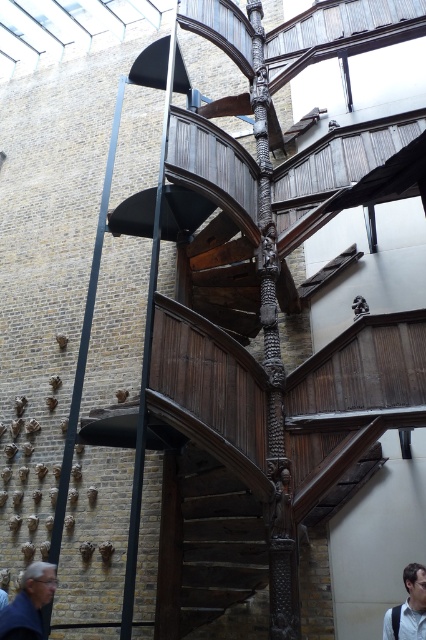
You are a GUI agent. You are given a task and a screenshot of the screen. Output one action in this format:
    pyautogui.click(x=<x>, y=<y>)
    Task: Click on the gray hair at lower left
    The height and width of the screenshot is (640, 426).
    Given the screenshot: What is the action you would take?
    28,604

Who is positioned more to the left, gray hair at lower left or light blue shirt at lower right?

Positioned to the left is gray hair at lower left.

Is point (23, 598) behind point (417, 593)?

No, (23, 598) is closer to viewer.

The height and width of the screenshot is (640, 426). What are the coordinates of `gray hair at lower left` in the screenshot? It's located at (28, 604).

Is black metal pole at center bigger than light blue shirt at lower right?

Yes.

The image size is (426, 640). Find the location of `black metal pole at center`. black metal pole at center is located at coordinates (146, 364).

Is point (169, 77) closer to viewer compared to point (416, 621)?

No, (169, 77) is further to viewer.

This screenshot has height=640, width=426. Identify the location of black metal pole at center. (146, 364).

Is point (201, 541) closer to camera compared to point (68, 464)?

That is False.

Between wooden stairs at center and black metal pole at left, which one appears on the right side from the viewer's perspective?

Positioned to the right is wooden stairs at center.

Between point (198, 460) and point (80, 364), which one is positioned behind?

Point (198, 460)

Image resolution: width=426 pixels, height=640 pixels. I want to click on wooden stairs at center, so (216, 540).